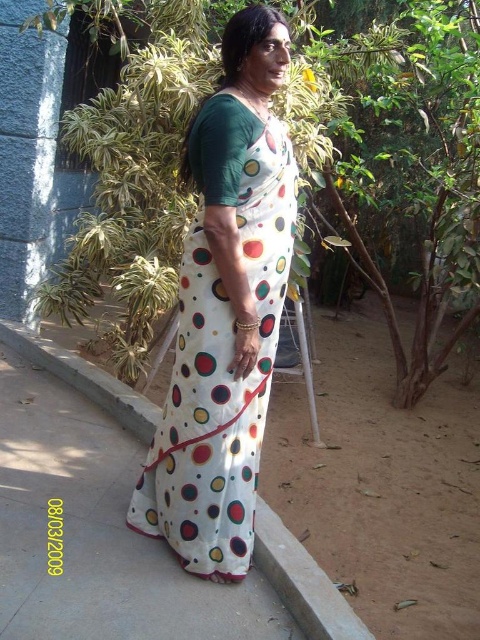
Question: Does white dotted fabric dress at center appear under white fabric at center?

Choices:
 (A) no
 (B) yes

Answer: (A)

Question: Does white dotted fabric dress at center have a smaller size compared to white fabric at center?

Choices:
 (A) yes
 (B) no

Answer: (A)

Question: Which point is farther from the camera taking this photo?

Choices:
 (A) (252, 401)
 (B) (151, 417)

Answer: (B)

Question: Does white dotted fabric dress at center appear under white fabric at center?

Choices:
 (A) yes
 (B) no

Answer: (B)